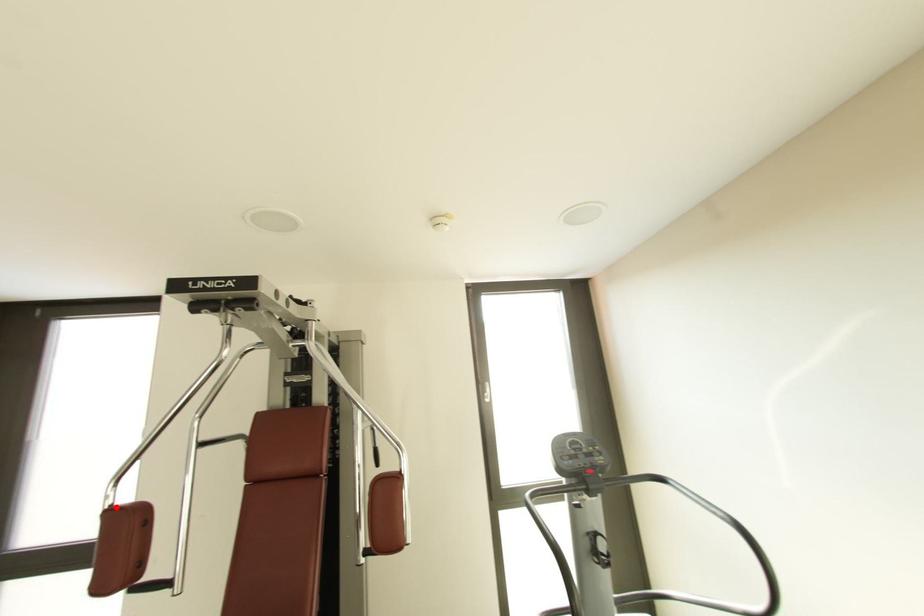
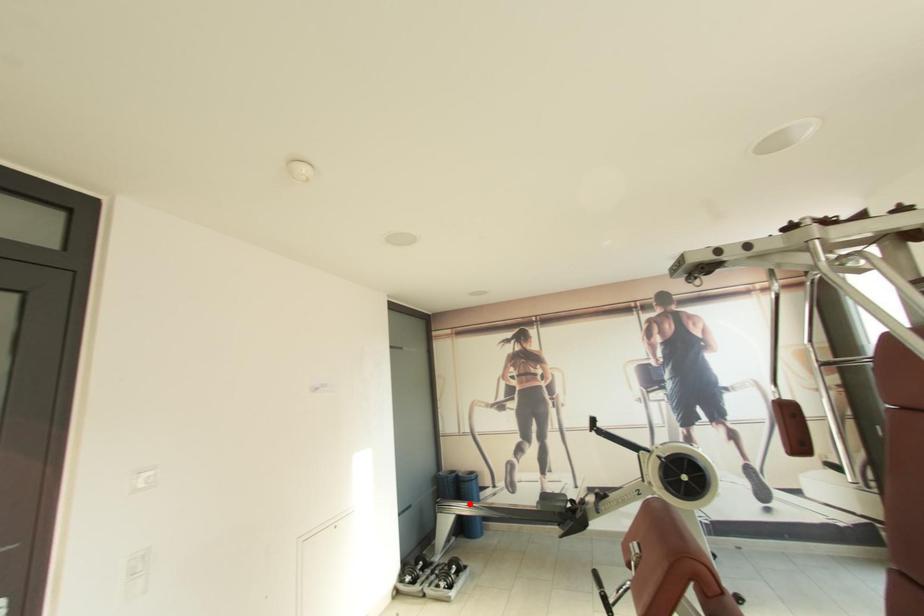
Consider the image. I am providing you with two images of the same scene from different viewpoints. A red point is marked on the first image and another point is marked on the second image. Is the red point in image1 aligned with the point shown in image2?

No